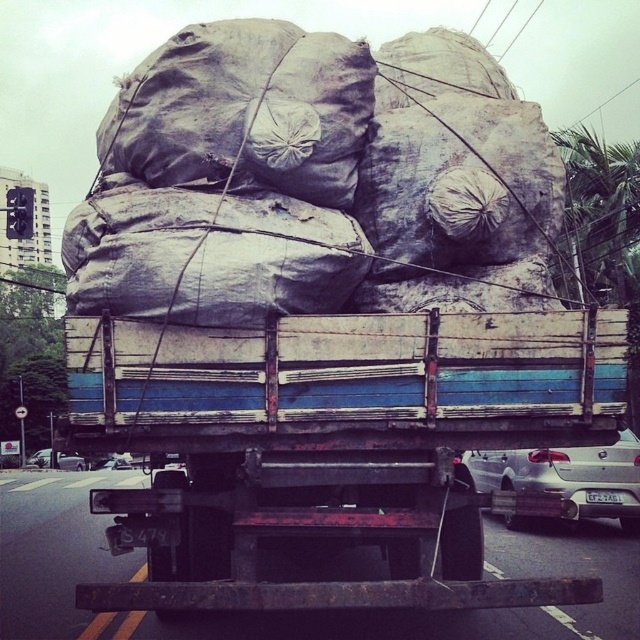
In the scene shown: Does silver metallic car at lower right come behind silver metallic sedan at lower left?

That is True.

Does silver metallic car at lower right lie in front of silver metallic sedan at lower left?

That is False.

The image size is (640, 640). Identify the location of silver metallic car at lower right. (568, 477).

Identify the location of silver metallic car at lower right. The image size is (640, 640). (568, 477).

Is point (266, 499) farther from camera compared to point (51, 452)?

No.

Locate an element on the screen. Image resolution: width=640 pixels, height=640 pixels. rusty metal trailer truck at center is located at coordinates (333, 448).

The image size is (640, 640). In order to click on rusty metal trailer truck at center in this screenshot , I will do `click(333, 448)`.

Which is above, rusty metal trailer truck at center or silver metallic car at lower right?

rusty metal trailer truck at center is above.

Does point (406, 490) come behind point (540, 472)?

No, (406, 490) is in front of (540, 472).

The height and width of the screenshot is (640, 640). In order to click on rusty metal trailer truck at center in this screenshot , I will do `click(333, 448)`.

I want to click on rusty metal trailer truck at center, so click(x=333, y=448).